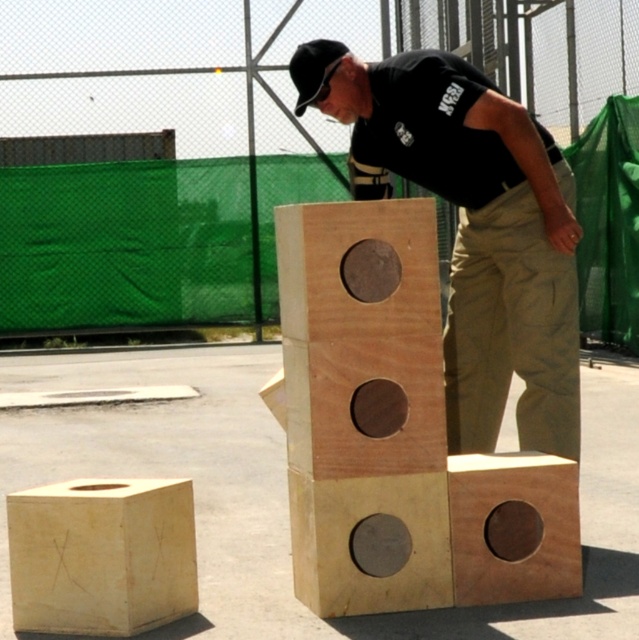
Question: Which of these objects is positioned farthest from the khaki pants at center?

Choices:
 (A) natural wood block at center
 (B) matte brown wooden block at center
 (C) black matte baseball hat at upper center

Answer: (C)

Question: Which of the following is the farthest from the observer?

Choices:
 (A) light wood block at lower left
 (B) natural wood block at center
 (C) black matte baseball hat at upper center

Answer: (C)

Question: Can you confirm if matte brown wooden block at center is positioned to the left of natural wood block at center?

Choices:
 (A) yes
 (B) no

Answer: (A)

Question: Which of these objects is positioned farthest from the light wood block at lower left?

Choices:
 (A) black matte baseball hat at upper center
 (B) natural wood block at center

Answer: (A)

Question: Can you confirm if khaki pants at center is smaller than natural wood block at center?

Choices:
 (A) yes
 (B) no

Answer: (B)

Question: Observing the image, what is the correct spatial positioning of khaki pants at center in reference to black matte baseball hat at upper center?

Choices:
 (A) right
 (B) left

Answer: (A)